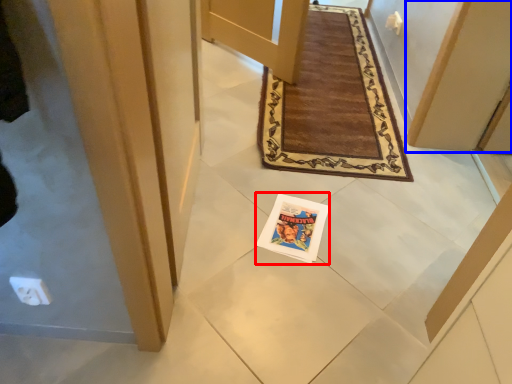
Question: Which object is further to the camera taking this photo, magazine (highlighted by a red box) or door (highlighted by a blue box)?

Choices:
 (A) magazine
 (B) door

Answer: (A)